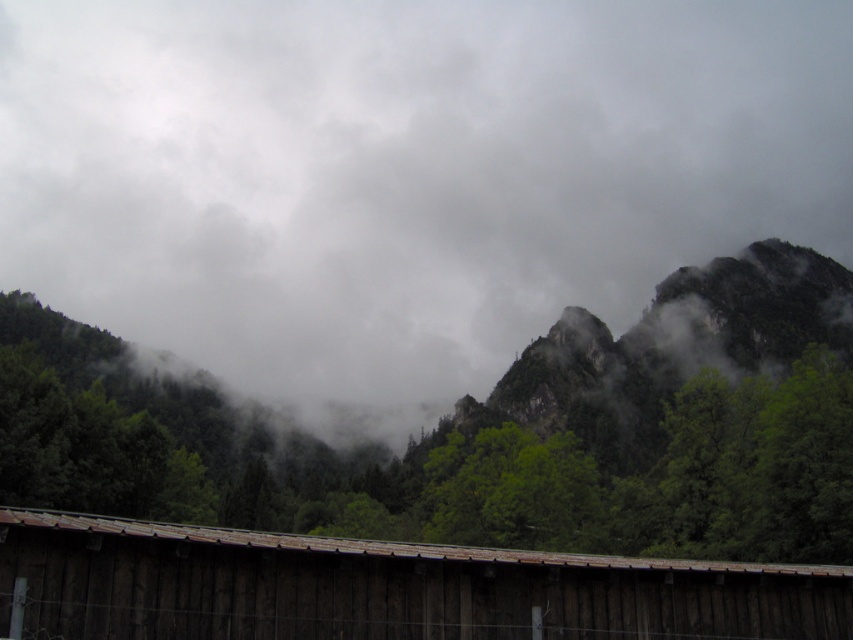
Does green matte tree at center have a larger size compared to brown wooden hut at lower center?

Yes.

Who is lower down, green matte tree at center or brown wooden hut at lower center?

green matte tree at center is lower down.

What do you see at coordinates (433, 461) in the screenshot?
I see `green matte tree at center` at bounding box center [433, 461].

At what (x,y) coordinates should I click in order to perform the action: click on green matte tree at center. Please return your answer as a coordinate pair (x, y). The height and width of the screenshot is (640, 853). Looking at the image, I should click on (433, 461).

Can you confirm if cloudy gray sky at upper center is positioned below green rocky mountain at center?

No, cloudy gray sky at upper center is not below green rocky mountain at center.

Is cloudy gray sky at upper center to the left of green rocky mountain at center from the viewer's perspective?

Indeed, cloudy gray sky at upper center is positioned on the left side of green rocky mountain at center.

Is point (697, 180) closer to viewer compared to point (624, 353)?

That is False.

Where is `cloudy gray sky at upper center`? The width and height of the screenshot is (853, 640). cloudy gray sky at upper center is located at coordinates (403, 176).

What do you see at coordinates (403, 176) in the screenshot?
I see `cloudy gray sky at upper center` at bounding box center [403, 176].

Is cloudy gray sky at upper center taller than green matte tree at center?

Indeed, cloudy gray sky at upper center has a greater height compared to green matte tree at center.

Who is more forward, (82, 92) or (84, 346)?

Point (84, 346) is in front.

Identify the location of cloudy gray sky at upper center. (403, 176).